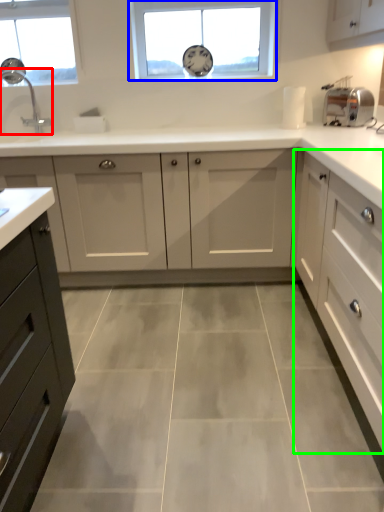
Question: Considering the real-world distances, which object is farthest from tap (highlighted by a red box)? window (highlighted by a blue box) or cabinetry (highlighted by a green box)?

Choices:
 (A) window
 (B) cabinetry

Answer: (B)